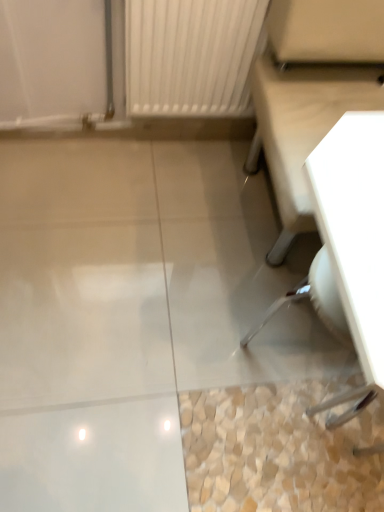
Question: Can you confirm if clear plastic swivel chair at lower right is bigger than white glossy table at upper right?

Choices:
 (A) no
 (B) yes

Answer: (A)

Question: From a real-world perspective, does clear plastic swivel chair at lower right stand above white glossy table at upper right?

Choices:
 (A) no
 (B) yes

Answer: (A)

Question: Does clear plastic swivel chair at lower right have a smaller size compared to white glossy table at upper right?

Choices:
 (A) no
 (B) yes

Answer: (B)

Question: Is clear plastic swivel chair at lower right facing towards white glossy table at upper right?

Choices:
 (A) yes
 (B) no

Answer: (B)

Question: Can you confirm if clear plastic swivel chair at lower right is taller than white glossy table at upper right?

Choices:
 (A) no
 (B) yes

Answer: (A)

Question: From a real-world perspective, is clear plastic swivel chair at lower right below white glossy table at upper right?

Choices:
 (A) yes
 (B) no

Answer: (A)

Question: Is white glossy table at upper right far away from clear plastic swivel chair at lower right?

Choices:
 (A) yes
 (B) no

Answer: (B)

Question: Considering the relative sizes of white glossy table at upper right and clear plastic swivel chair at lower right in the image provided, is white glossy table at upper right thinner than clear plastic swivel chair at lower right?

Choices:
 (A) yes
 (B) no

Answer: (B)

Question: Is white glossy table at upper right next to clear plastic swivel chair at lower right and touching it?

Choices:
 (A) yes
 (B) no

Answer: (B)

Question: Is clear plastic swivel chair at lower right surrounded by white glossy table at upper right?

Choices:
 (A) no
 (B) yes

Answer: (A)

Question: Is white glossy table at upper right in front of clear plastic swivel chair at lower right?

Choices:
 (A) yes
 (B) no

Answer: (A)

Question: Is white glossy table at upper right at the left side of clear plastic swivel chair at lower right?

Choices:
 (A) no
 (B) yes

Answer: (A)

Question: Is white glossy table at upper right in front of or behind clear plastic swivel chair at lower right in the image?

Choices:
 (A) behind
 (B) front

Answer: (B)